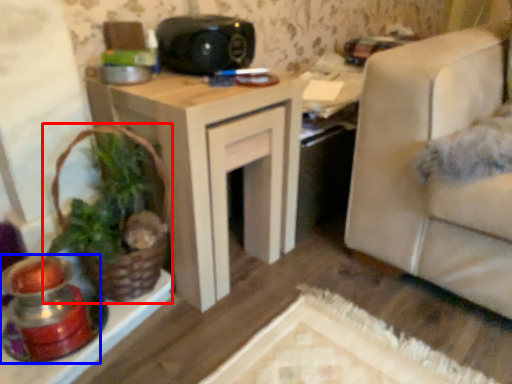
Question: Which object is further to the camera taking this photo, houseplant (highlighted by a red box) or candle holder (highlighted by a blue box)?

Choices:
 (A) houseplant
 (B) candle holder

Answer: (A)